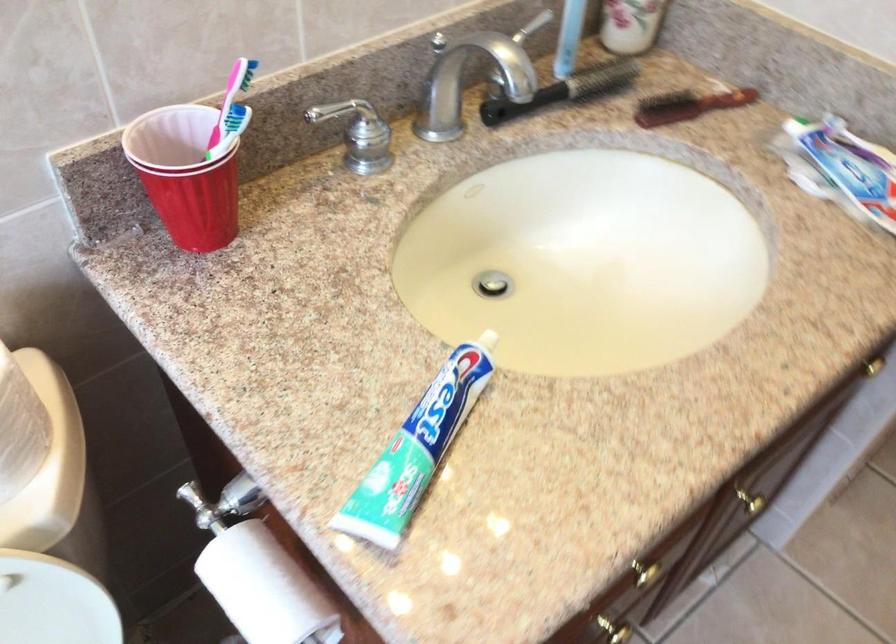
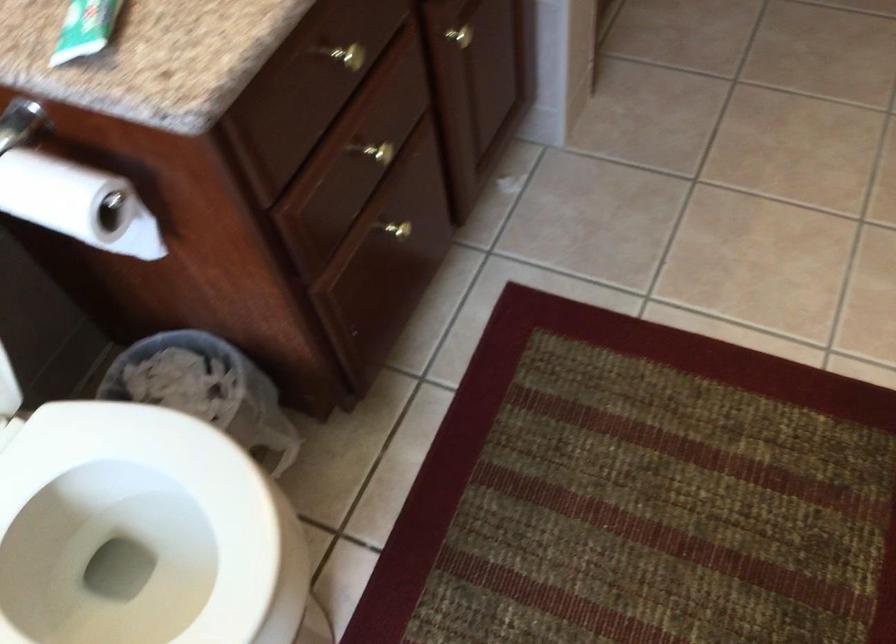
Question: What movement of the cameraman would produce the second image?

Choices:
 (A) Left
 (B) Right
 (C) Forward
 (D) Backward

Answer: (D)